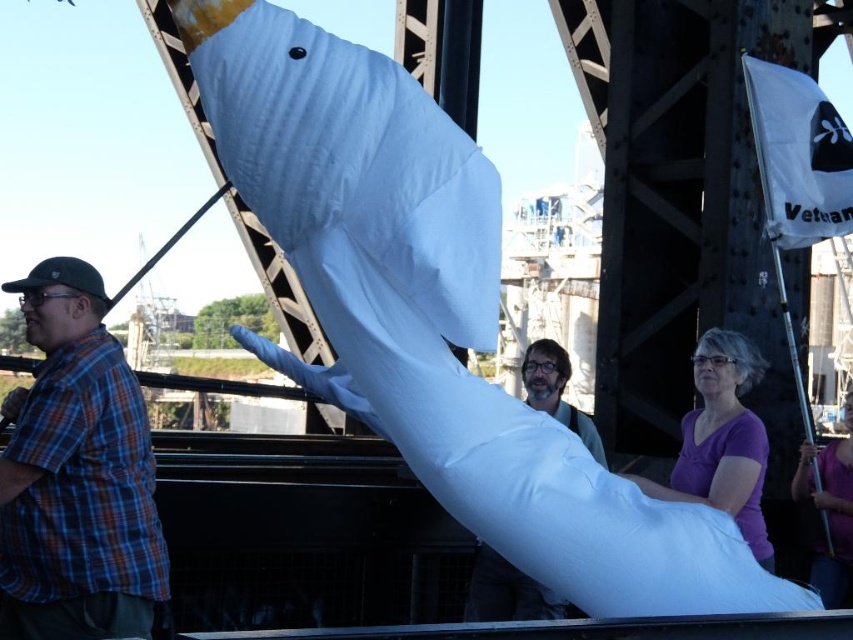
Is plaid shirt at left wider than matte white pillow at center?

Correct, the width of plaid shirt at left exceeds that of matte white pillow at center.

Can you confirm if plaid shirt at left is smaller than matte white pillow at center?

Indeed, plaid shirt at left has a smaller size compared to matte white pillow at center.

Who is more forward, (10, 593) or (482, 570)?

Point (10, 593) is in front.

You are a GUI agent. You are given a task and a screenshot of the screen. Output one action in this format:
    pyautogui.click(x=<x>, y=<y>)
    Task: Click on the plaid shirt at left
    The width and height of the screenshot is (853, 640).
    Given the screenshot: What is the action you would take?
    [76, 474]

Can you confirm if matte white pillow at center is positioned above purple matte shirt at lower right?

Yes.

Does matte white pillow at center have a larger size compared to purple matte shirt at lower right?

Incorrect, matte white pillow at center is not larger than purple matte shirt at lower right.

Between point (482, 604) and point (848, 413), which one is positioned behind?

The point (848, 413) is more distant.

Where is `matte white pillow at center`? The width and height of the screenshot is (853, 640). matte white pillow at center is located at coordinates (506, 593).

The height and width of the screenshot is (640, 853). Describe the element at coordinates (722, 440) in the screenshot. I see `purple matte shirt at center` at that location.

Which is more to the left, purple matte shirt at center or purple matte shirt at lower right?

Positioned to the left is purple matte shirt at center.

Is point (753, 465) closer to viewer compared to point (824, 564)?

Yes, point (753, 465) is closer to viewer.

Locate an element on the screen. purple matte shirt at center is located at coordinates (722, 440).